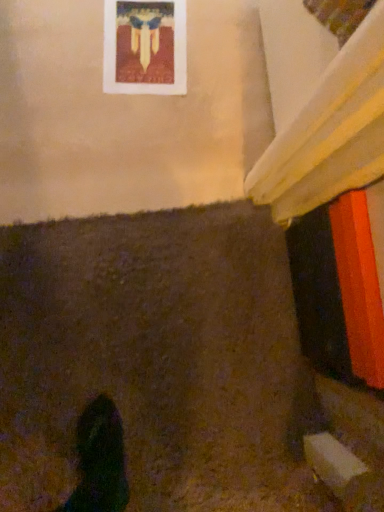
Locate an element on the screen. Image resolution: width=384 pixels, height=512 pixels. free space in front of matte paper picture frame at upper center is located at coordinates (77, 100).